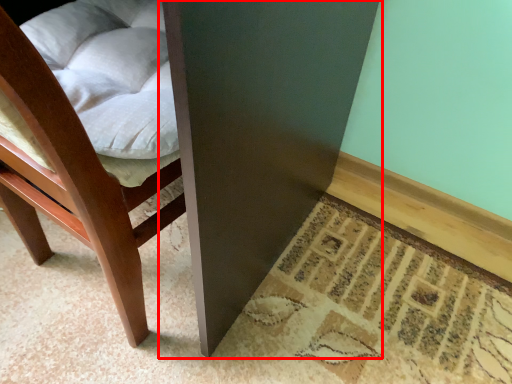
Question: Where is table (annotated by the red box) located in relation to chair in the image?

Choices:
 (A) right
 (B) left

Answer: (B)